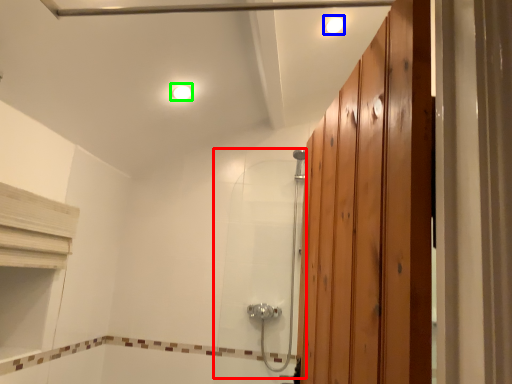
Question: Which object is positioned farthest from shower door (highlighted by a red box)? Select from light fixture (highlighted by a blue box) and light fixture (highlighted by a green box).

Choices:
 (A) light fixture
 (B) light fixture

Answer: (A)